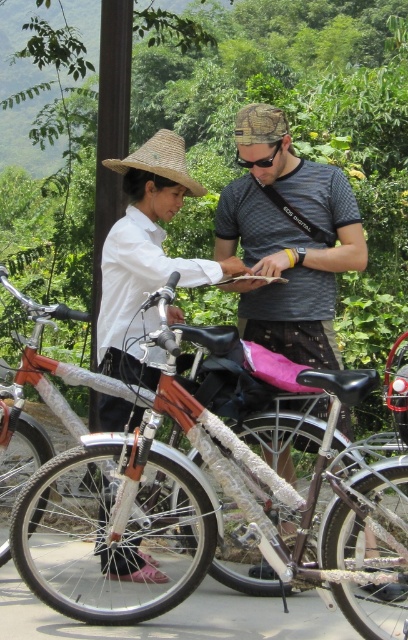
Is matte straw hat at center to the left of strawmaterial/texturehat at upper center from the viewer's perspective?

In fact, matte straw hat at center is to the right of strawmaterial/texturehat at upper center.

Is matte straw hat at center positioned at the back of strawmaterial/texturehat at upper center?

That is False.

Which is in front, point (104, 403) or point (144, 170)?

Point (144, 170)

Identify the location of matte straw hat at center. (146, 253).

Can you confirm if dark gray textured shirt at center is smaller than matte straw hat at center?

Yes.

Is the position of dark gray textured shirt at center less distant than that of matte straw hat at center?

No, dark gray textured shirt at center is further to the viewer.

Between point (285, 273) and point (204, 276), which one is positioned behind?

The point (285, 273) is more distant.

Where is `dark gray textured shirt at center`? dark gray textured shirt at center is located at coordinates pyautogui.click(x=288, y=237).

Between shiny metallic bicycle at center and strawmaterial/texturehat at upper center, which one is positioned higher?

Positioned higher is strawmaterial/texturehat at upper center.

Does shiny metallic bicycle at center appear over strawmaterial/texturehat at upper center?

Incorrect, shiny metallic bicycle at center is not positioned above strawmaterial/texturehat at upper center.

Is point (33, 301) closer to camera compared to point (170, 160)?

Yes, it is.

This screenshot has width=408, height=640. Identify the location of shiny metallic bicycle at center. (206, 499).